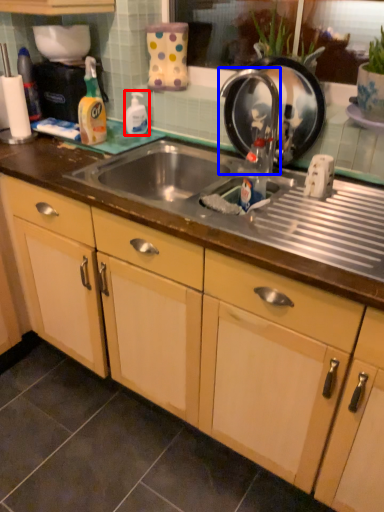
Question: Which object is further to the camera taking this photo, cleaning product (highlighted by a red box) or faucet (highlighted by a blue box)?

Choices:
 (A) cleaning product
 (B) faucet

Answer: (A)